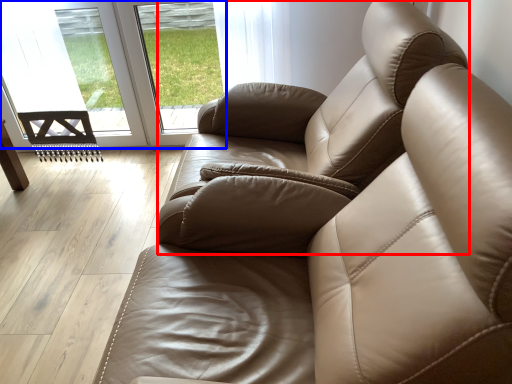
Question: Among these objects, which one is farthest to the camera, armchair (highlighted by a red box) or glass door (highlighted by a blue box)?

Choices:
 (A) armchair
 (B) glass door

Answer: (B)